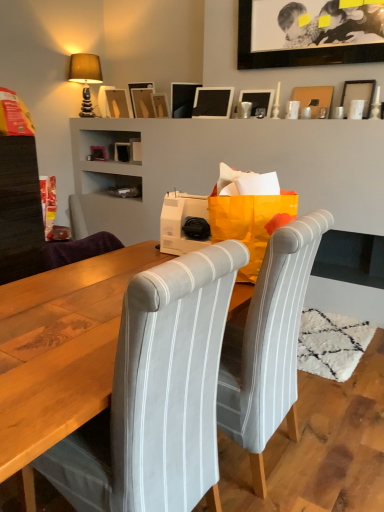
Question: Considering the positions of point (360, 98) and point (299, 46), is point (360, 98) closer or farther from the camera than point (299, 46)?

Choices:
 (A) closer
 (B) farther

Answer: (A)

Question: From a real-world perspective, relative to black matte picture frame at upper center, positioned as the seventh picture frame in left-to-right order, is matte black picture frame at upper right, the ninth picture frame from the left, vertically above or below?

Choices:
 (A) below
 (B) above

Answer: (A)

Question: Based on their relative distances, which object is nearer to the white striped fabric chair at center, marked as the 2th chair in a left-to-right arrangement?

Choices:
 (A) wooden picture frame at upper center, the seventh picture frame when ordered from right to left
 (B) black matte picture frame at upper center, which ranks as the 3th picture frame in right-to-left order
 (C) matte cardboard picture frame at upper center, which is the 2th picture frame from right to left
 (D) gray fabric chair at center, arranged as the 2th chair when viewed from the right
 (E) matte wood picture frame at upper center, the 9th picture frame viewed from the right

Answer: (D)

Question: Estimate the real-world distances between objects in this image. Which object is farther from the black matte picture frame at upper center, which ranks as the 3th picture frame in right-to-left order?

Choices:
 (A) wooden picture frame at upper center, marked as the third picture frame in a left-to-right arrangement
 (B) matte brown fabric lampshade at upper left
 (C) matte cardboard picture frame at upper center, which is the 2th picture frame from right to left
 (D) white striped fabric chair at center, placed as the first chair when sorted from right to left
 (E) matte black picture frame at upper center, the sixth picture frame positioned from the right

Answer: (D)